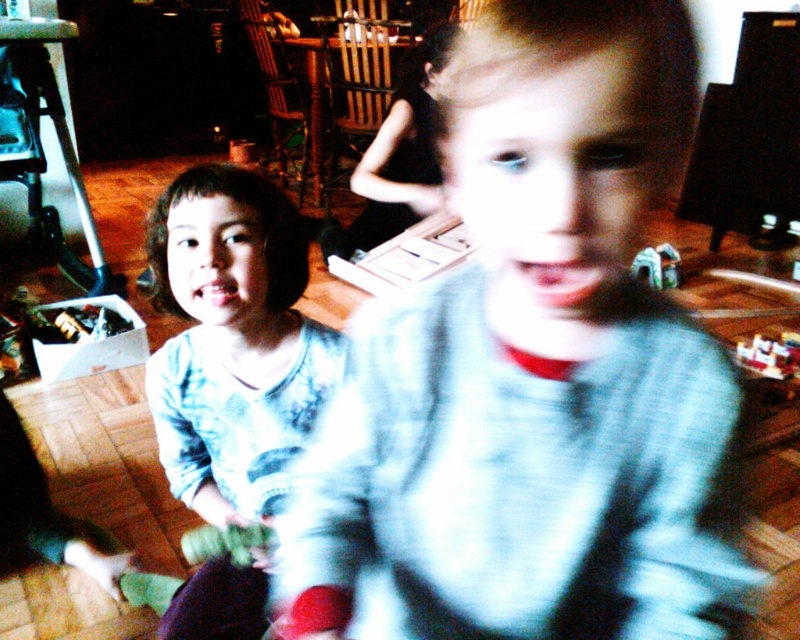
You are a photographer trying to focus on the light blue sweater at center. The camera is currently focused on point (532, 374). Is the camera focused on the correct object?

Yes, the camera is focused on the correct object because point (532, 374) is on the light blue sweater at center.

You are a photographer adjusting your camera focus. You notice two points in the scene labeled as point (770, 342) and point (674, 282). Which point should you focus on first if you want to ensure the closer object is sharp?

Point (770, 342) is closer to the camera than point (674, 282), so you should focus on point (770, 342) first to ensure the closer object is sharp.

You are a parent trying to organize your childen room. You see the light blue cotton shirt at center and the plastic toy car at lower right. Which item is closer to the left side of the room?

The light blue cotton shirt at center is closer to the left side of the room because it is positioned to the left of the plastic toy car at lower right.